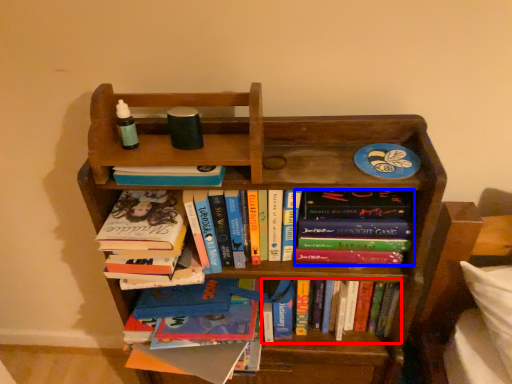
Question: Among these objects, which one is nearest to the camera, book (highlighted by a red box) or book (highlighted by a blue box)?

Choices:
 (A) book
 (B) book

Answer: (B)